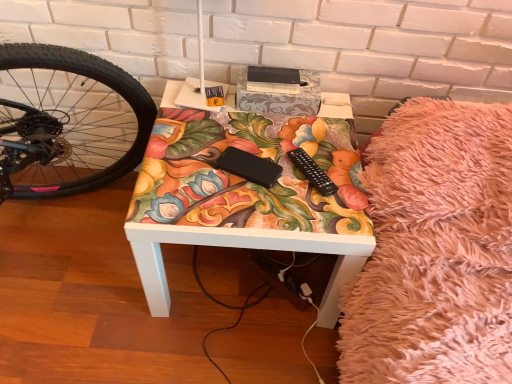
Identify the location of vacant area on top of painted wood table at center (from a real-world perspective). (257, 150).